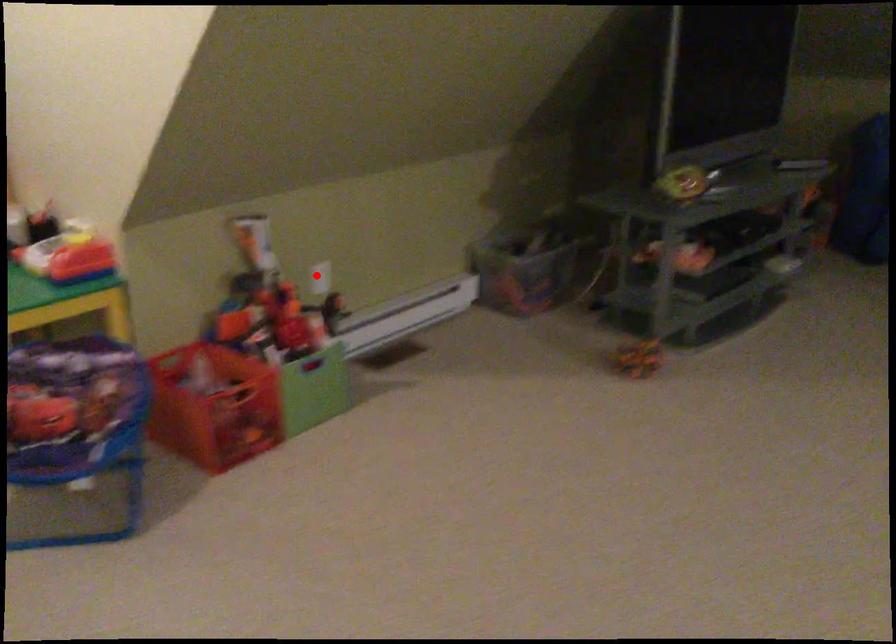
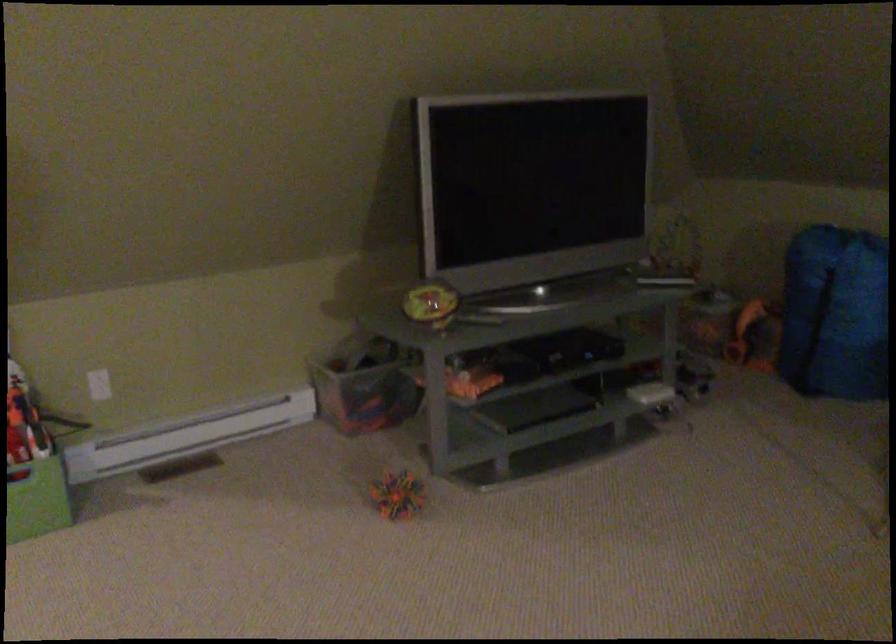
The point at the highlighted location is marked in the first image. Where is the corresponding point in the second image?

(99, 384)